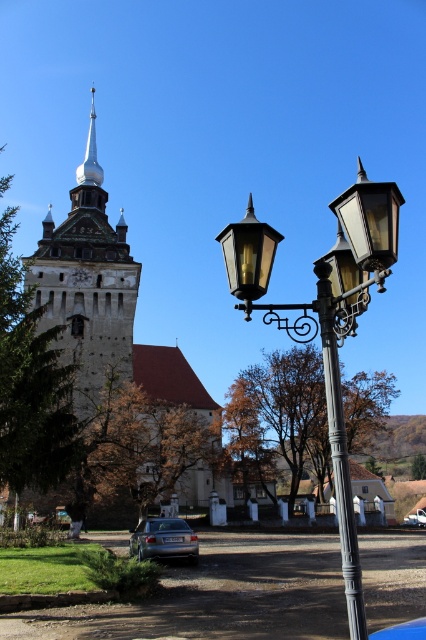
Question: Which object is positioned closest to the dark brown stone church at upper left?

Choices:
 (A) satin silver sedan at lower left
 (B) silver metallic car at center
 (C) white glossy spire at upper center
 (D) matte black street light at center

Answer: (A)

Question: Is matte black street light at center smaller than wooden spire at upper left?

Choices:
 (A) no
 (B) yes

Answer: (A)

Question: Which object is the closest to the matte black street light at center?

Choices:
 (A) wooden spire at upper left
 (B) silver metallic car at center

Answer: (A)

Question: Among these points, which one is farthest from the camera?

Choices:
 (A) (89, 182)
 (B) (324, 339)
 (C) (419, 508)

Answer: (A)

Question: Is wooden spire at upper left bigger than silver metallic car at center?

Choices:
 (A) no
 (B) yes

Answer: (B)

Question: Can you confirm if matte black street light at center is wider than white glossy spire at upper center?

Choices:
 (A) yes
 (B) no

Answer: (A)